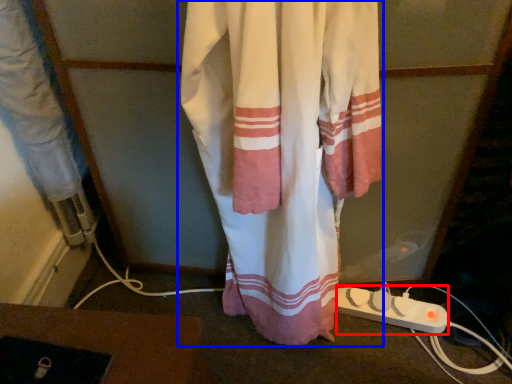
Question: Which object is further to the camera taking this photo, extension cord (highlighted by a red box) or curtain (highlighted by a blue box)?

Choices:
 (A) extension cord
 (B) curtain

Answer: (A)